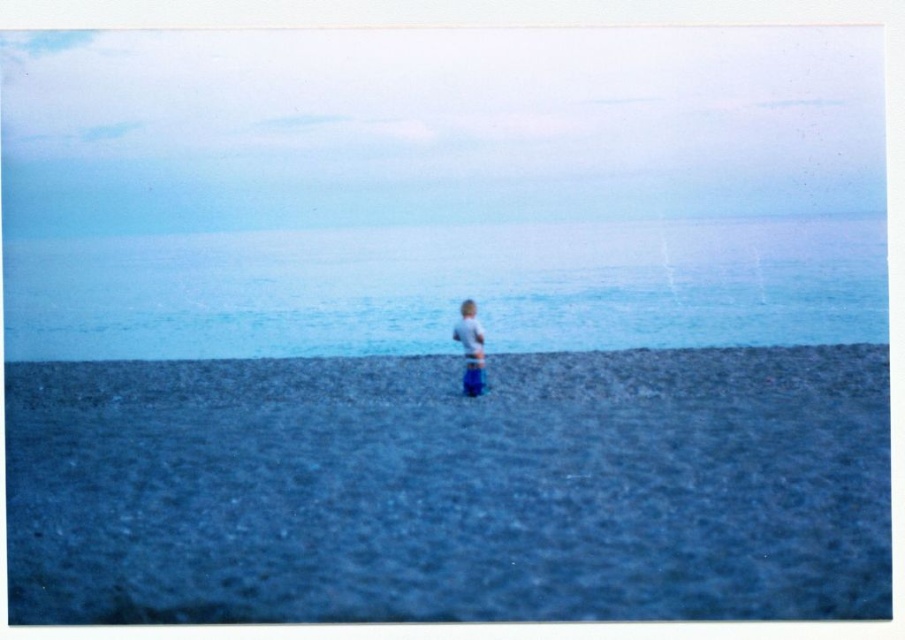
Question: Estimate the real-world distances between objects in this image. Which object is closer to the dark gray gravel at center?

Choices:
 (A) blue water at center
 (B) white cotton shirt at center

Answer: (B)

Question: Is dark gray gravel at center above white cotton shirt at center?

Choices:
 (A) no
 (B) yes

Answer: (A)

Question: Is dark gray gravel at center positioned at the back of white cotton shirt at center?

Choices:
 (A) no
 (B) yes

Answer: (A)

Question: Which point appears closest to the camera in this image?

Choices:
 (A) (93, 285)
 (B) (461, 333)

Answer: (B)

Question: Which object is farther from the camera taking this photo?

Choices:
 (A) white cotton shirt at center
 (B) blue water at center

Answer: (B)

Question: Does blue water at center appear on the left side of white cotton shirt at center?

Choices:
 (A) yes
 (B) no

Answer: (A)